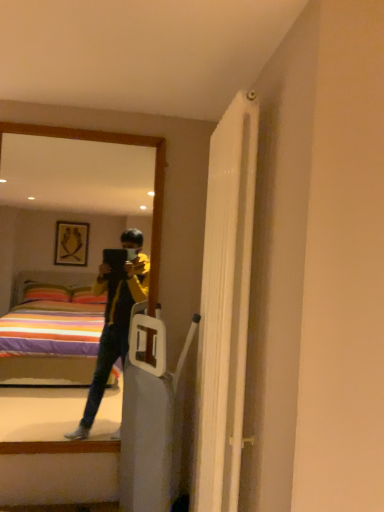
Question: Should I look upward or downward to see white textured radiator at upper right?

Choices:
 (A) down
 (B) up

Answer: (A)

Question: Can you confirm if matte black mirror at left is positioned to the left of white textured radiator at upper right?

Choices:
 (A) no
 (B) yes

Answer: (B)

Question: Is the position of matte black mirror at left less distant than that of white textured radiator at upper right?

Choices:
 (A) no
 (B) yes

Answer: (A)

Question: Is matte black mirror at left not inside white textured radiator at upper right?

Choices:
 (A) yes
 (B) no

Answer: (A)

Question: Can you confirm if matte black mirror at left is shorter than white textured radiator at upper right?

Choices:
 (A) yes
 (B) no

Answer: (A)

Question: Considering the relative sizes of matte black mirror at left and white textured radiator at upper right in the image provided, is matte black mirror at left taller than white textured radiator at upper right?

Choices:
 (A) yes
 (B) no

Answer: (B)

Question: From the image's perspective, is matte black mirror at left under white textured radiator at upper right?

Choices:
 (A) yes
 (B) no

Answer: (B)

Question: Is the depth of white textured radiator at upper right greater than that of matte black mirror at left?

Choices:
 (A) yes
 (B) no

Answer: (B)

Question: Does white textured radiator at upper right have a lesser width compared to matte black mirror at left?

Choices:
 (A) no
 (B) yes

Answer: (A)

Question: Can you confirm if white textured radiator at upper right is shorter than matte black mirror at left?

Choices:
 (A) no
 (B) yes

Answer: (A)

Question: Is white textured radiator at upper right surrounding matte black mirror at left?

Choices:
 (A) no
 (B) yes

Answer: (A)

Question: Does white textured radiator at upper right have a greater width compared to matte black mirror at left?

Choices:
 (A) yes
 (B) no

Answer: (A)

Question: Could you tell me if white textured radiator at upper right is facing matte black mirror at left?

Choices:
 (A) no
 (B) yes

Answer: (A)

Question: Based on their sizes in the image, would you say white textured radiator at upper right is bigger or smaller than matte black mirror at left?

Choices:
 (A) small
 (B) big

Answer: (B)